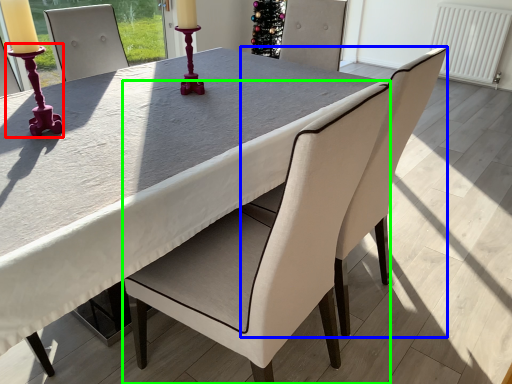
Question: Based on their relative distances, which object is nearer to candle holder (highlighted by a red box)? Choose from chair (highlighted by a blue box) and chair (highlighted by a green box).

Choices:
 (A) chair
 (B) chair

Answer: (B)